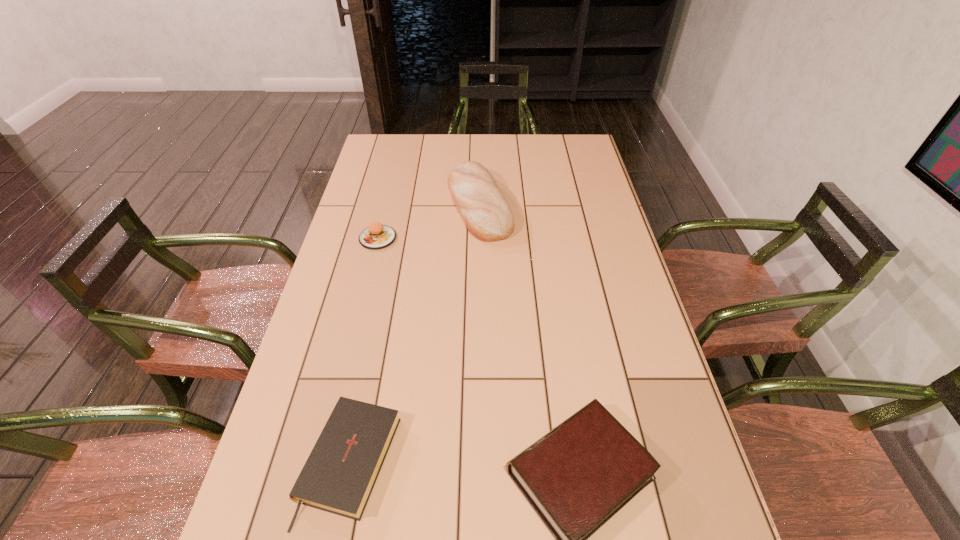
The height and width of the screenshot is (540, 960). In order to click on vacant space at the left edge of the desktop in this screenshot , I will do `click(371, 207)`.

Where is `blank area at the right edge`? This screenshot has width=960, height=540. blank area at the right edge is located at coordinates (612, 339).

The image size is (960, 540). Find the location of `free region at the far left corner of the desktop`. free region at the far left corner of the desktop is located at coordinates (404, 142).

At what (x,y) coordinates should I click in order to perform the action: click on vacant region at the far right corner of the desktop. Please return your answer as a coordinate pair (x, y). Image resolution: width=960 pixels, height=540 pixels. Looking at the image, I should click on (554, 139).

What are the coordinates of `free space between the tallest object and the shorter Bible` in the screenshot? It's located at (415, 334).

The height and width of the screenshot is (540, 960). In order to click on free space between the shorter Bible and the patty in this screenshot , I will do `click(364, 350)`.

Identify the location of free space that is in between the patty and the bread. (429, 221).

This screenshot has width=960, height=540. I want to click on blank region between the shortest object and the patty, so click(364, 350).

Identify the location of free space that is in between the patty and the tallest object. (429, 221).

This screenshot has height=540, width=960. Identify the location of free space that is in between the shorter Bible and the patty. (364, 350).